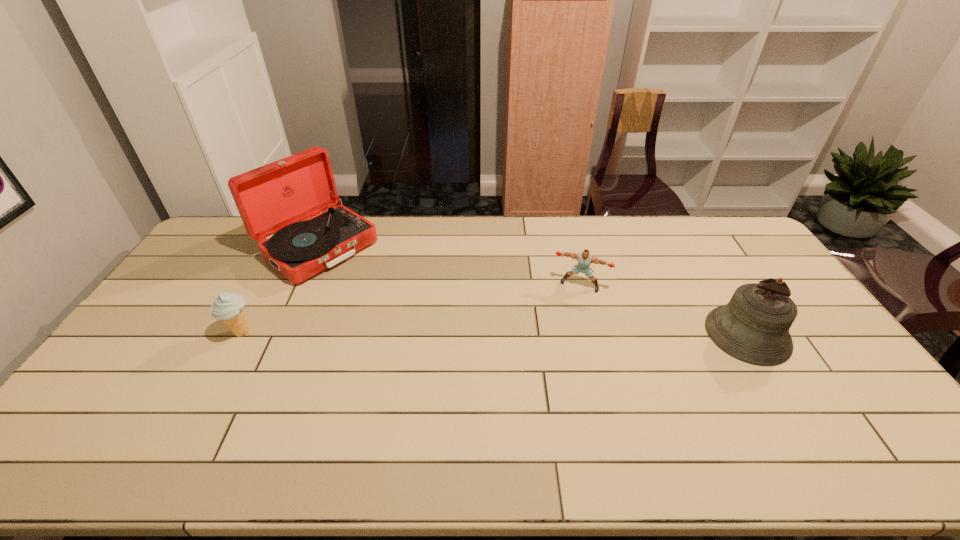
Where is `vacant spot on the desktop that is between the icecream and the rightmost object and is positioned on the front-facing side of the puncher`? vacant spot on the desktop that is between the icecream and the rightmost object and is positioned on the front-facing side of the puncher is located at coordinates (564, 334).

At what (x,y) coordinates should I click in order to perform the action: click on vacant space on the desktop that is between the icecream and the rightmost object and is positioned on the front-facing side of the tallest object. Please return your answer as a coordinate pair (x, y). Looking at the image, I should click on click(x=438, y=333).